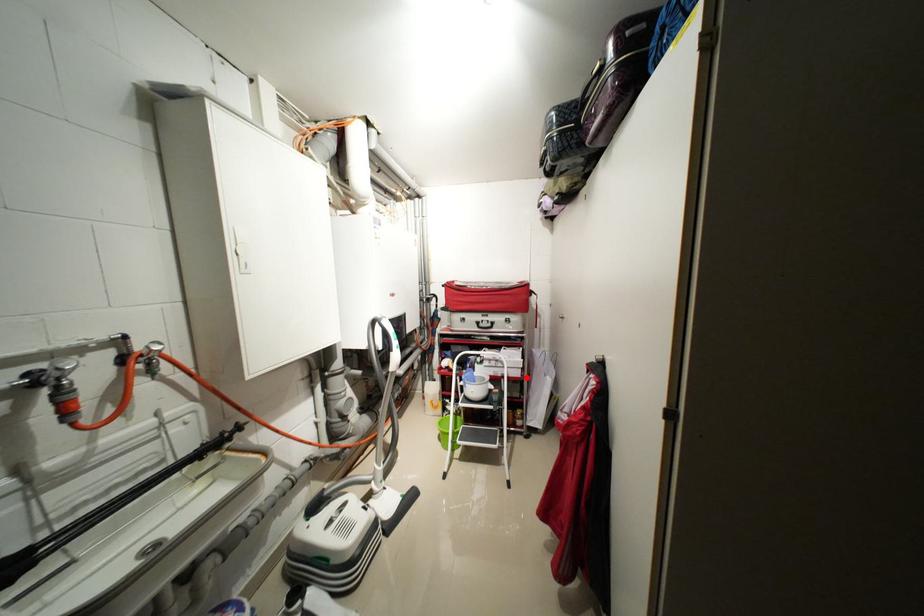
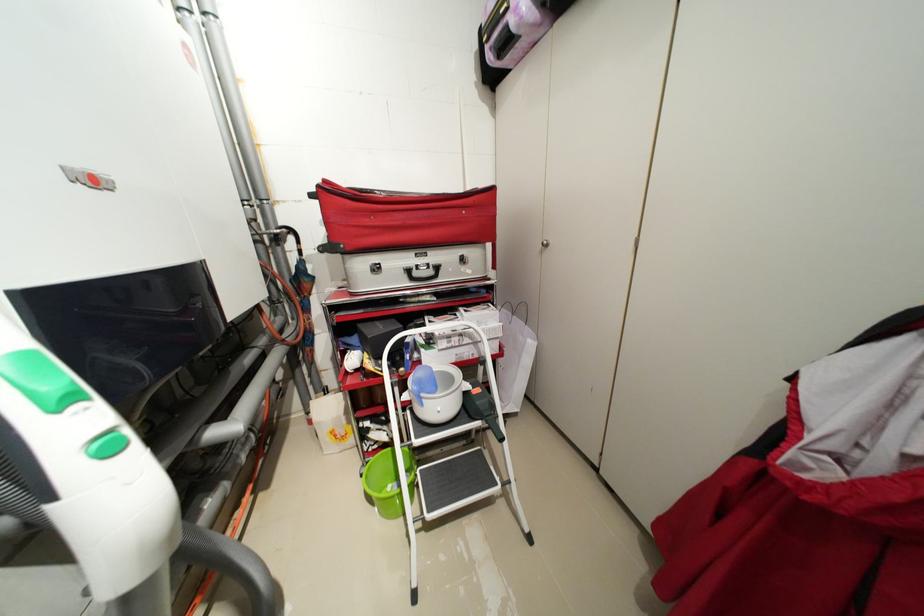
In the second image, find the point that corresponds to the highlighted location in the first image.

(505, 352)